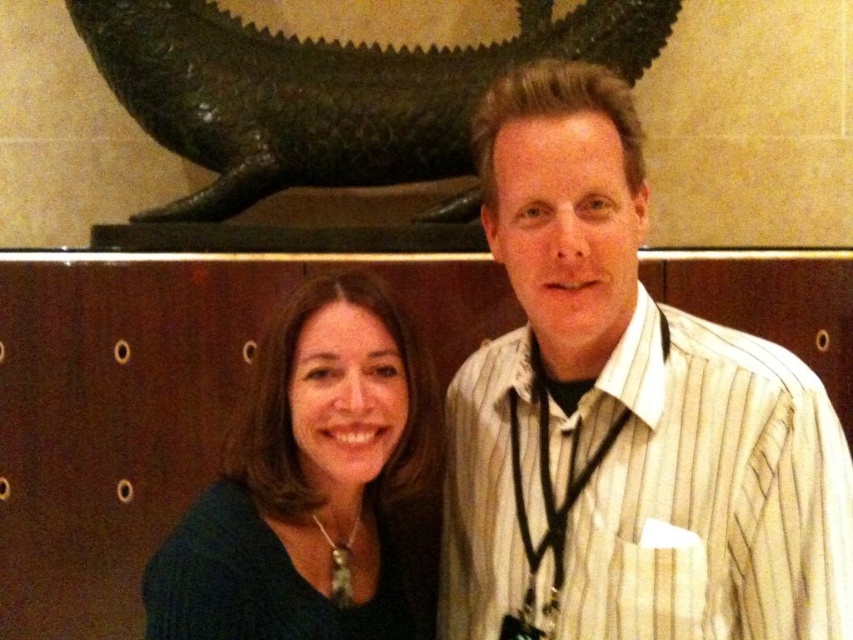
In the scene shown: You are standing in front of the image and want to determine which of the two points, point(x=329, y=339) or point(x=396, y=154), is nearer to you. Based on the scene, can you identify the closer point?

Point(x=329, y=339) is closer to the viewer than point(x=396, y=154).

You are standing in a room where two people are posing for a photo. The woman on the left is wearing a dark green top, and the man on the right has a striped light shirt with a lanyard. There is a dark green sweater at center located at point (314, 486). If you were to walk straight towards the dark green sweater at center, which direction should you face?

You should face towards the center of the room where the dark green sweater at center is located at point (314, 486).